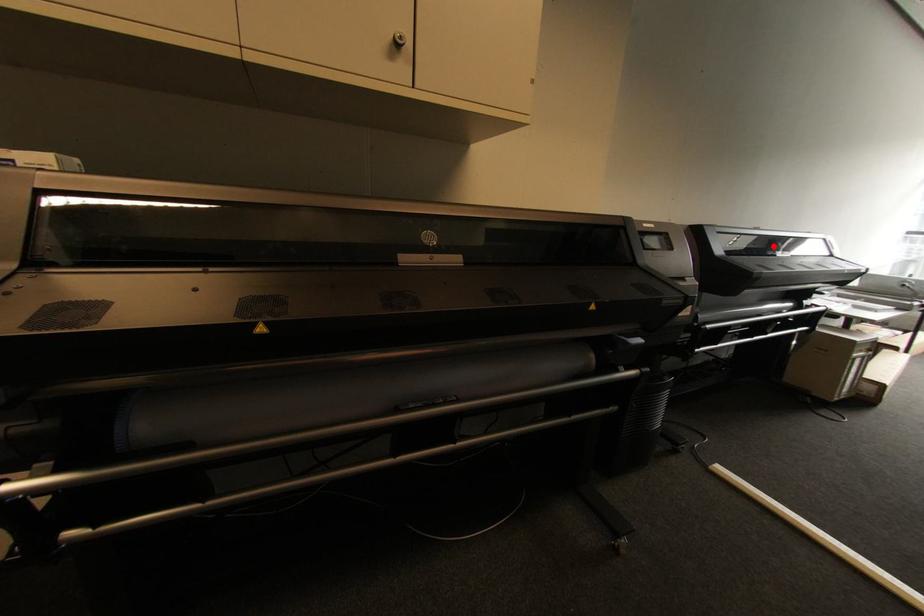
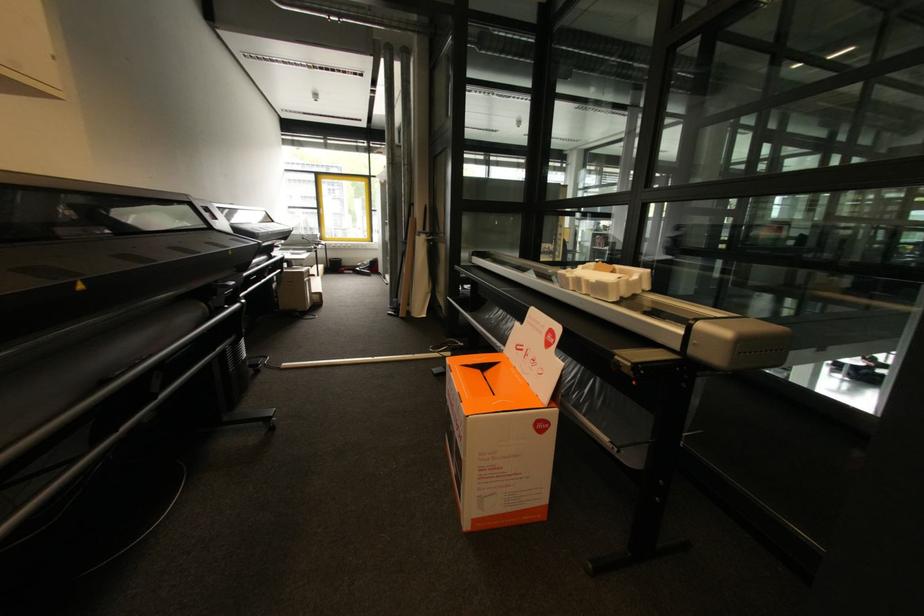
Question: I am providing you with two images of the same scene from different viewpoints. A red point is marked on the first image. At the location where the point appears in image 1, is it still visible in image 2?

Choices:
 (A) Yes
 (B) No

Answer: (A)